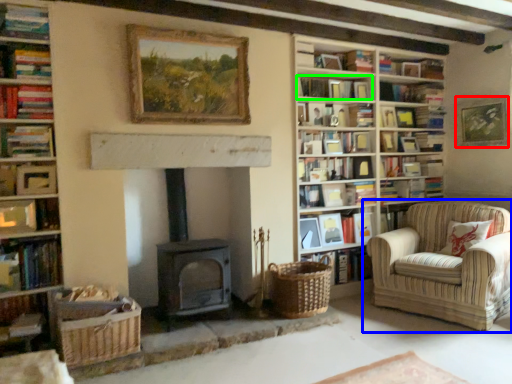
Question: Considering the real-world distances, which object is closest to picture frame (highlighted by a red box)? chair (highlighted by a blue box) or book (highlighted by a green box).

Choices:
 (A) chair
 (B) book

Answer: (A)